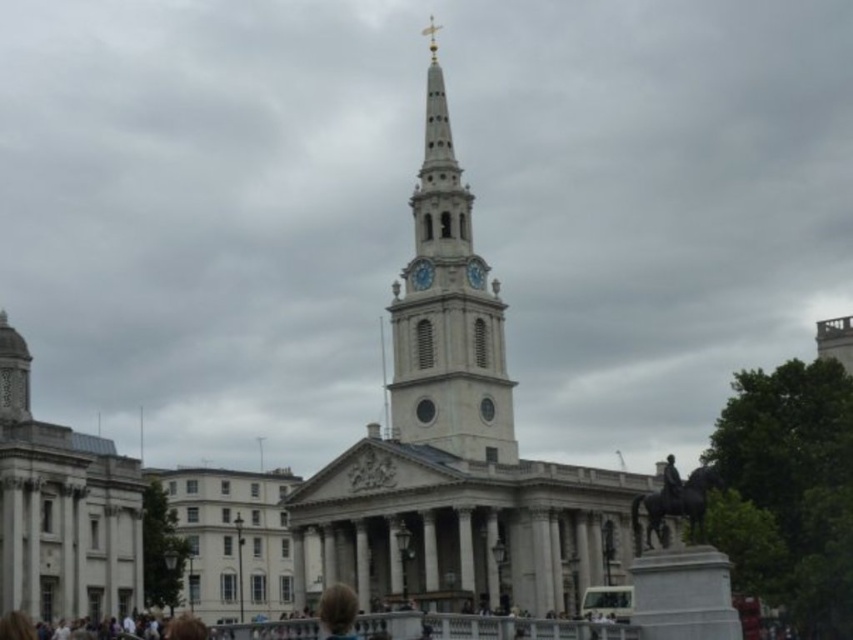
You are a tourist standing in front of the grand architectural structure. You notice the white stone clock tower at center and the white stone building at left. Which one appears larger to you?

The white stone clock tower at center appears larger than the white stone building at left because it is bigger.

You are standing in front of the grand structure and want to take a photo of both the white stone clock tower at center and the white stone building at left. Based on their positions, which one should you position to your left side in the camera frame?

You should position the white stone building at left to your left side in the camera frame because the white stone clock tower at center is to the right of the white stone building at left.